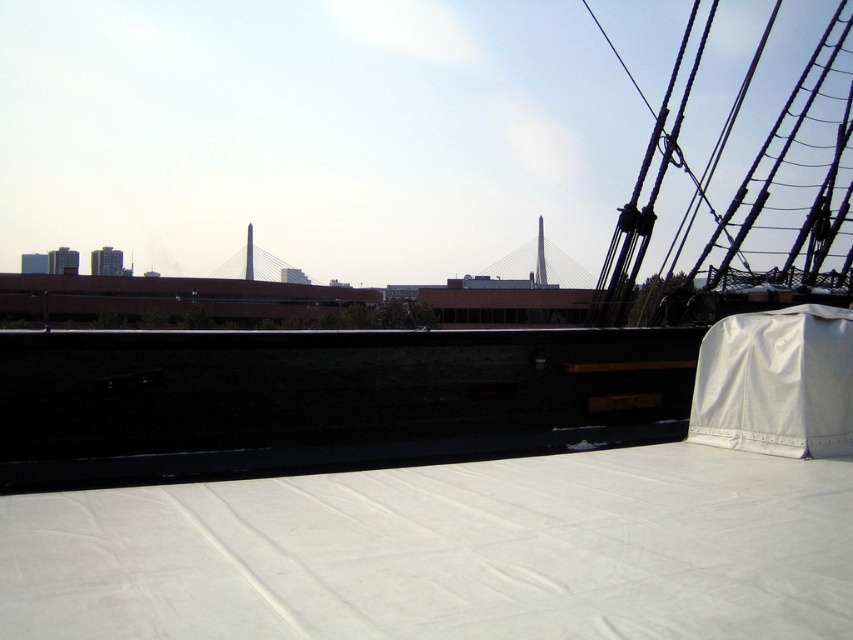
Question: Is white matte sheet at lower center thinner than white fabric cover at upper right?

Choices:
 (A) no
 (B) yes

Answer: (A)

Question: Does white matte sheet at lower center have a larger size compared to white fabric cover at upper right?

Choices:
 (A) yes
 (B) no

Answer: (B)

Question: Can you confirm if white matte sheet at lower center is positioned above white fabric cover at upper right?

Choices:
 (A) no
 (B) yes

Answer: (A)

Question: Which of the following is the closest to the observer?

Choices:
 (A) white fabric cover at upper right
 (B) white matte sheet at lower center

Answer: (B)

Question: Which of the following is the closest to the observer?

Choices:
 (A) tap(636, 520)
 (B) tap(846, 385)

Answer: (A)